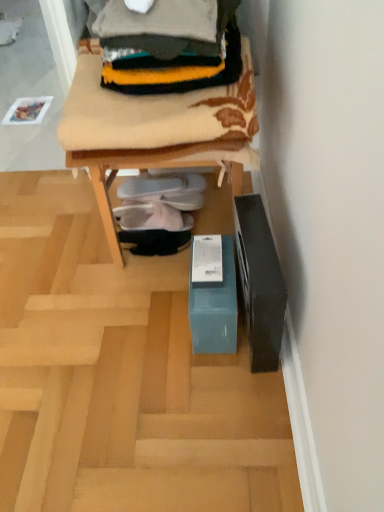
Question: From a real-world perspective, is teal cardboard box at lower center beneath teal cardboard box at lower center?

Choices:
 (A) yes
 (B) no

Answer: (B)

Question: Does teal cardboard box at lower center lie behind teal cardboard box at lower center?

Choices:
 (A) no
 (B) yes

Answer: (A)

Question: Can you confirm if teal cardboard box at lower center is positioned to the right of teal cardboard box at lower center?

Choices:
 (A) yes
 (B) no

Answer: (A)

Question: Does teal cardboard box at lower center contain teal cardboard box at lower center?

Choices:
 (A) yes
 (B) no

Answer: (B)

Question: Can you confirm if teal cardboard box at lower center is taller than teal cardboard box at lower center?

Choices:
 (A) no
 (B) yes

Answer: (B)

Question: Is teal cardboard box at lower center touching teal cardboard box at lower center?

Choices:
 (A) yes
 (B) no

Answer: (B)

Question: Is white fabric slipper at center, which is the third footwear in bottom-to-top order, wider than teal cardboard box at lower center?

Choices:
 (A) no
 (B) yes

Answer: (A)

Question: From a real-world perspective, is white fabric slipper at center, which is the third footwear in bottom-to-top order, located beneath teal cardboard box at lower center?

Choices:
 (A) yes
 (B) no

Answer: (B)

Question: Does white fabric slipper at center, which is the first footwear from top to bottom, have a greater height compared to teal cardboard box at lower center?

Choices:
 (A) no
 (B) yes

Answer: (B)

Question: Could you tell me if white fabric slipper at center, which is the first footwear from top to bottom, is turned towards teal cardboard box at lower center?

Choices:
 (A) no
 (B) yes

Answer: (A)

Question: Are white fabric slipper at center, which is the first footwear from top to bottom, and teal cardboard box at lower center far apart?

Choices:
 (A) yes
 (B) no

Answer: (B)

Question: Is white fabric slipper at center, which is the third footwear in bottom-to-top order, positioned in front of teal cardboard box at lower center?

Choices:
 (A) no
 (B) yes

Answer: (A)

Question: Does white fabric shoe at center, the second footwear from the top, have a lesser height compared to teal cardboard box at lower center?

Choices:
 (A) no
 (B) yes

Answer: (A)